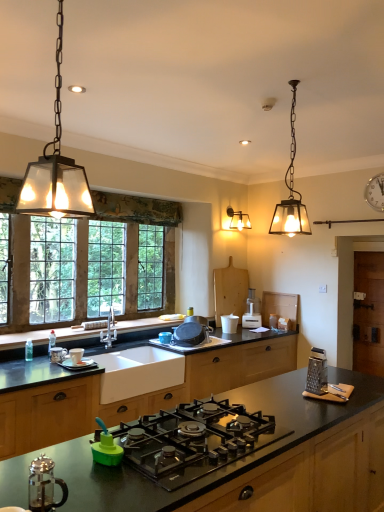
At what (x,y) coordinates should I click in order to perform the action: click on free spot behind clear glass french press at lower left. Please return your answer as a coordinate pair (x, y). Image resolution: width=384 pixels, height=512 pixels. Looking at the image, I should click on (86, 485).